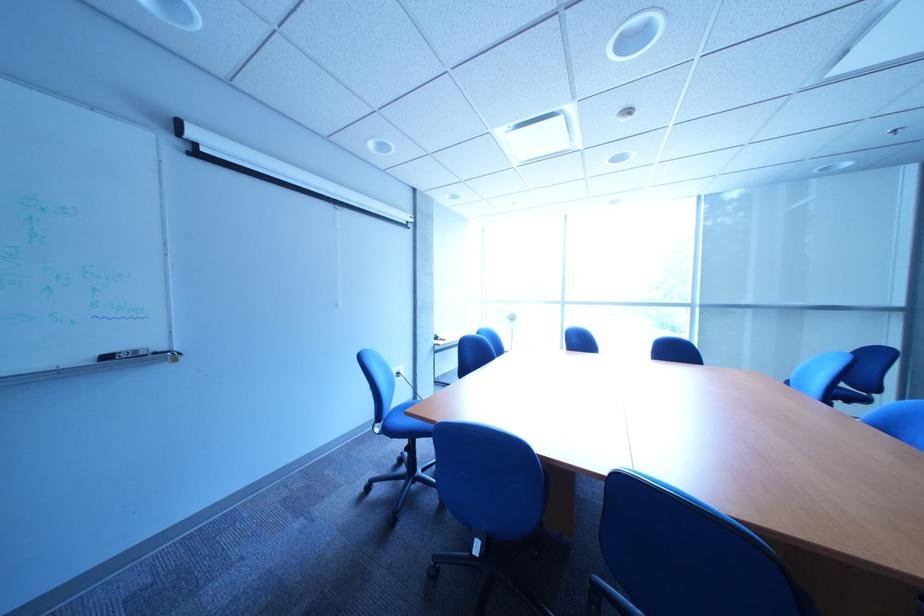
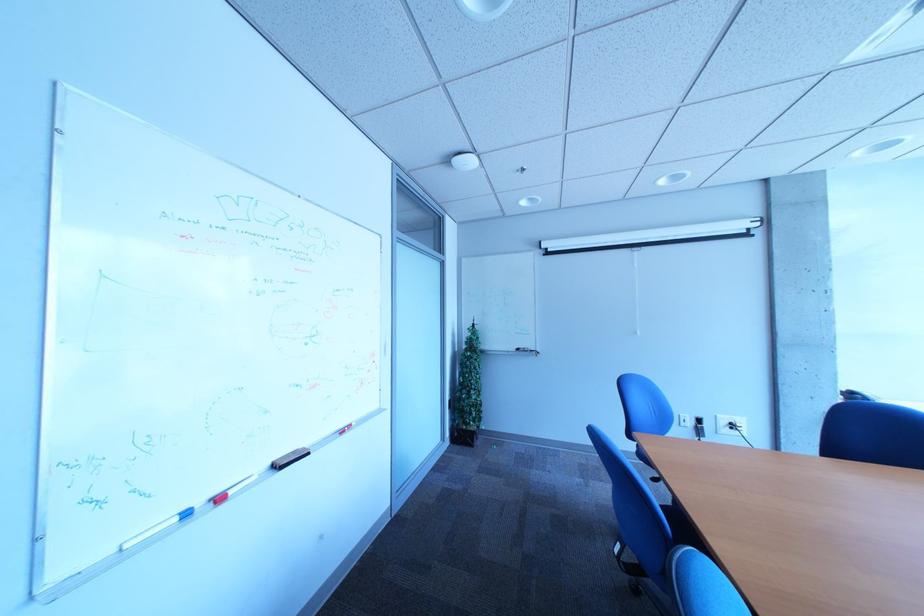
Locate, in the second image, the point that corresponds to point (409, 376) in the first image.

(739, 424)